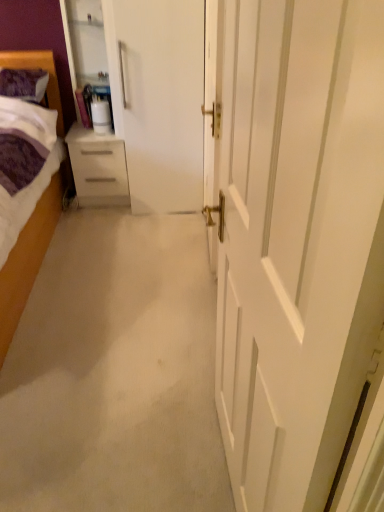
Question: From the image's perspective, is purple soft pillow at upper left located above or below purple soft fabric bed at left?

Choices:
 (A) above
 (B) below

Answer: (A)

Question: Is purple soft pillow at upper left situated inside purple soft fabric bed at left or outside?

Choices:
 (A) inside
 (B) outside

Answer: (A)

Question: Which of these objects is positioned farthest from the white glossy door at center?

Choices:
 (A) white glossy chest of drawers at left
 (B) purple soft fabric bed at left
 (C) purple soft pillow at upper left
 (D) transparent glass cabinet at upper left

Answer: (C)

Question: Considering the real-world distances, which object is farthest from the purple soft fabric bed at left?

Choices:
 (A) transparent glass cabinet at upper left
 (B) white glossy door at center
 (C) white glossy chest of drawers at left
 (D) purple soft pillow at upper left

Answer: (B)